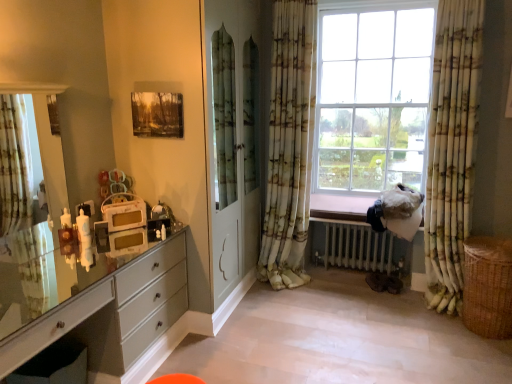
The width and height of the screenshot is (512, 384). I want to click on vacant space situated on the left part of green and white textured curtain at right, which is counted as the first curtain, starting from the right, so click(395, 312).